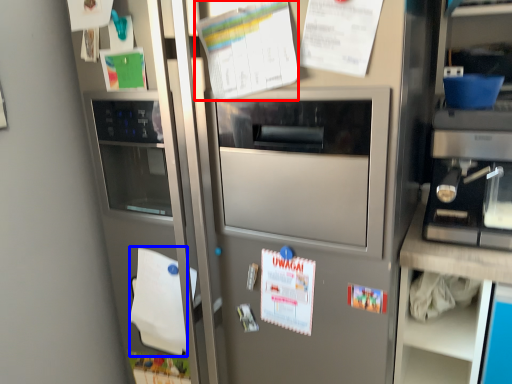
Question: Which object is further to the camera taking this photo, poster (highlighted by a red box) or notepad (highlighted by a blue box)?

Choices:
 (A) poster
 (B) notepad

Answer: (B)